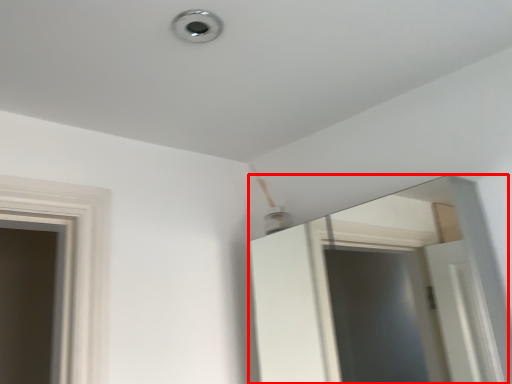
Question: From the image's perspective, what is the correct spatial positioning of mirror (annotated by the red box) in reference to light?

Choices:
 (A) above
 (B) below

Answer: (B)